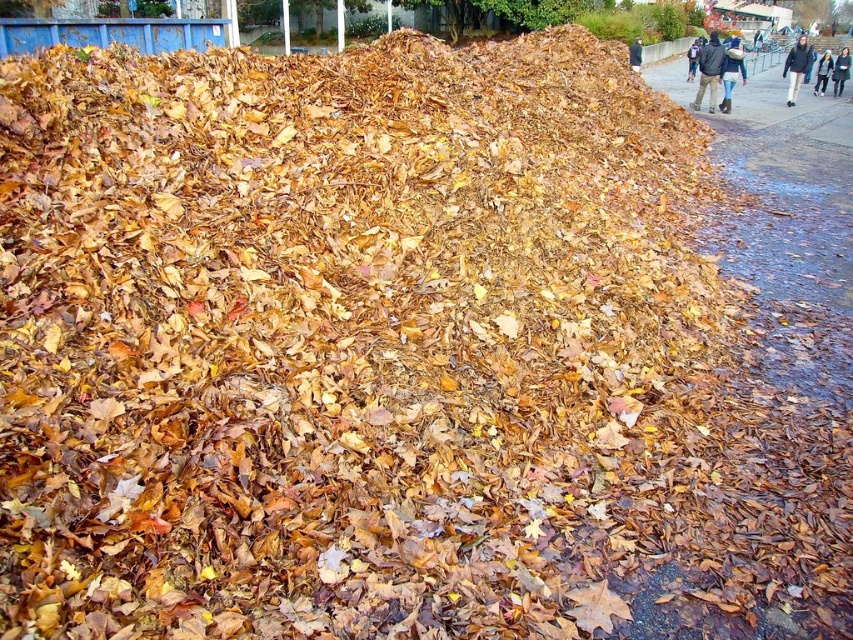
Question: Is light blue denim jacket at lower right to the right of brown leather jacket at upper center from the viewer's perspective?

Choices:
 (A) yes
 (B) no

Answer: (A)

Question: Can you confirm if dark gray pants at upper right is positioned to the left of light blue denim jacket at lower right?

Choices:
 (A) yes
 (B) no

Answer: (A)

Question: Which object is farther from the camera taking this photo?

Choices:
 (A) brown leather jacket at upper center
 (B) dark gray pants at upper right
 (C) light blue denim jacket at lower right

Answer: (C)

Question: Among these objects, which one is nearest to the camera?

Choices:
 (A) brown leather jacket at upper center
 (B) dark gray pants at upper right
 (C) light blue denim jacket at lower right

Answer: (A)

Question: Does dark gray pants at upper right appear on the left side of blue denim jeans at right?

Choices:
 (A) no
 (B) yes

Answer: (A)

Question: Considering the real-world distances, which object is farthest from the blue denim jeans at right?

Choices:
 (A) dark gray sweater at upper right
 (B) dark blue jacket at upper right

Answer: (A)